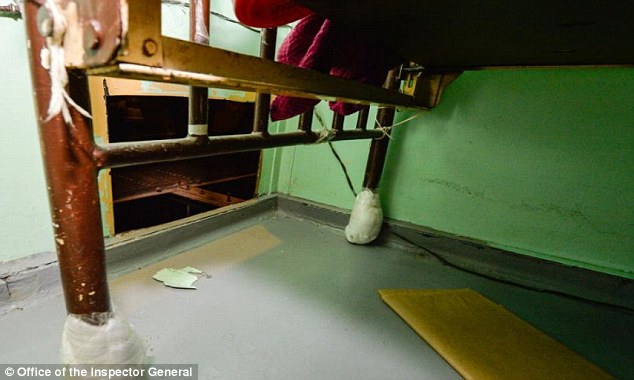
The image size is (634, 380). I want to click on edge of bed frame, so click(204, 102).